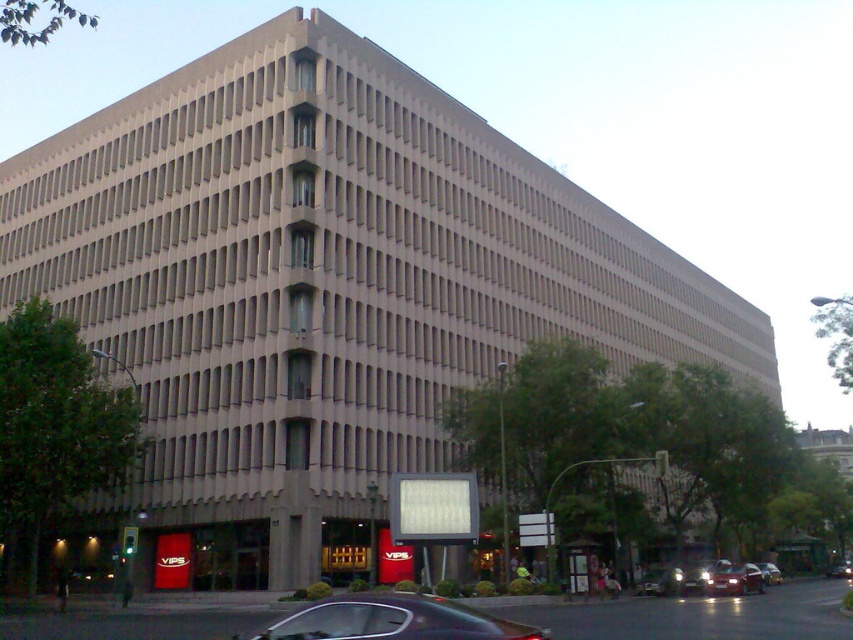
Can you confirm if shiny silver sedan at center is thinner than shiny silver car at center?

In fact, shiny silver sedan at center might be wider than shiny silver car at center.

Looking at this image, does shiny silver sedan at center have a larger size compared to shiny silver car at center?

Correct, shiny silver sedan at center is larger in size than shiny silver car at center.

The image size is (853, 640). Describe the element at coordinates (735, 579) in the screenshot. I see `shiny silver sedan at center` at that location.

What are the coordinates of `shiny silver sedan at center` in the screenshot? It's located at (x=735, y=579).

Which is more to the right, shiny silver car at center or metallic silver car at center?

metallic silver car at center

Identify the location of shiny silver car at center. (660, 580).

You are a GUI agent. You are given a task and a screenshot of the screen. Output one action in this format:
    pyautogui.click(x=<x>, y=<y>)
    Task: Click on the shiny silver car at center
    The width and height of the screenshot is (853, 640).
    Given the screenshot: What is the action you would take?
    pyautogui.click(x=660, y=580)

Which is in front, point (463, 620) or point (732, 572)?

Point (463, 620) is in front.

Does point (437, 611) lie behind point (722, 584)?

No, (437, 611) is closer to viewer.

Based on the photo, who is more forward, (448, 612) or (757, 566)?

Point (448, 612) is more forward.

Find the location of `shiny black sedan at lower center`. shiny black sedan at lower center is located at coordinates (393, 620).